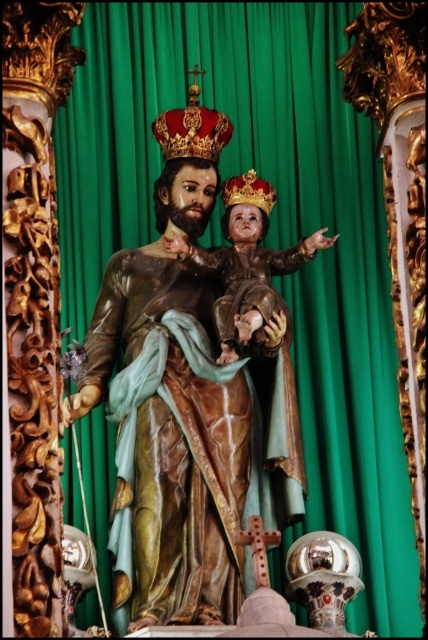
Question: Which of the following is the closest to the observer?

Choices:
 (A) shiny red crown at upper center
 (B) wooden cross at center

Answer: (B)

Question: Is shiny red crown at upper center further to the viewer compared to gold textured crown at center?

Choices:
 (A) yes
 (B) no

Answer: (A)

Question: Which object is positioned closest to the shiny red crown at upper center?

Choices:
 (A) gold textured crown at center
 (B) wooden cross at center

Answer: (A)

Question: Does shiny red crown at upper center come in front of gold textured crown at center?

Choices:
 (A) yes
 (B) no

Answer: (B)

Question: Which point is farther to the camera?

Choices:
 (A) (157, 129)
 (B) (228, 177)

Answer: (B)

Question: Is shiny red crown at upper center positioned at the back of gold textured crown at center?

Choices:
 (A) yes
 (B) no

Answer: (A)